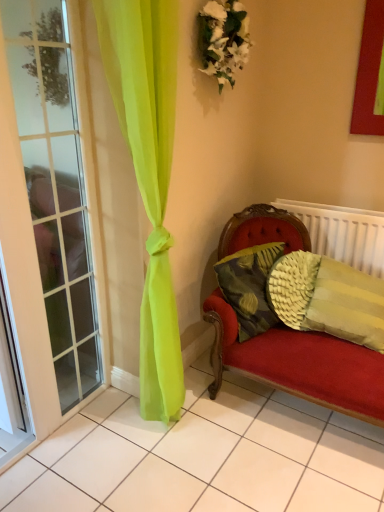
Question: Is textured yellow pillow at right, positioned as the first pillow in right-to-left order, spatially inside clear glass door at left, or outside of it?

Choices:
 (A) outside
 (B) inside

Answer: (A)

Question: Is textured yellow pillow at right, positioned as the first pillow in right-to-left order, bigger or smaller than clear glass door at left?

Choices:
 (A) big
 (B) small

Answer: (B)

Question: Which is nearer to the textured yellow pillow at right, positioned as the first pillow in right-to-left order?

Choices:
 (A) textured yellow pillow at right, which is the second pillow from right to left
 (B) white textured radiator at right
 (C) white fabric floral arrangement at upper center
 (D) clear glass door at left

Answer: (A)

Question: Which of these objects is positioned farthest from the clear glass door at left?

Choices:
 (A) textured yellow pillow at right, the first pillow from the left
 (B) white textured radiator at right
 (C) white fabric floral arrangement at upper center
 (D) textured yellow pillow at right, positioned as the first pillow in right-to-left order

Answer: (B)